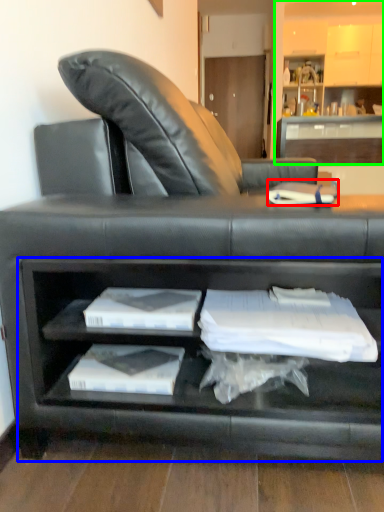
Question: Which object is positioned farthest from book (highlighted by a red box)? Select from cabinet (highlighted by a blue box) and entertainment center (highlighted by a green box).

Choices:
 (A) cabinet
 (B) entertainment center

Answer: (B)